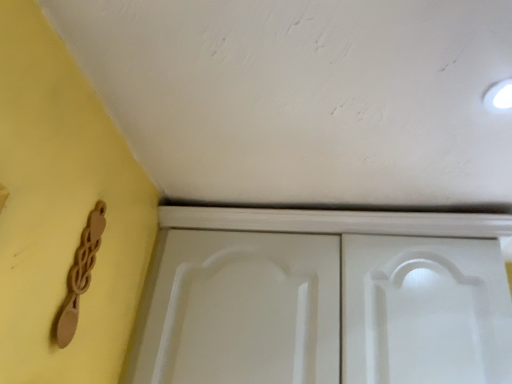
Question: Is there a large distance between wooden spoon at lower left and white matte cupboard at center?

Choices:
 (A) no
 (B) yes

Answer: (A)

Question: Does wooden spoon at lower left have a larger size compared to white matte cupboard at center?

Choices:
 (A) no
 (B) yes

Answer: (A)

Question: Does wooden spoon at lower left come in front of white matte cupboard at center?

Choices:
 (A) yes
 (B) no

Answer: (A)

Question: Is wooden spoon at lower left smaller than white matte cupboard at center?

Choices:
 (A) yes
 (B) no

Answer: (A)

Question: Does wooden spoon at lower left turn towards white matte cupboard at center?

Choices:
 (A) no
 (B) yes

Answer: (A)

Question: From the image's perspective, is wooden spoon at lower left over white matte cupboard at center?

Choices:
 (A) yes
 (B) no

Answer: (A)

Question: Is white matte cupboard at center not inside wooden spoon at lower left?

Choices:
 (A) no
 (B) yes

Answer: (B)

Question: Is white matte cupboard at center closer to camera compared to wooden spoon at lower left?

Choices:
 (A) no
 (B) yes

Answer: (A)

Question: Is the depth of white matte cupboard at center greater than that of wooden spoon at lower left?

Choices:
 (A) no
 (B) yes

Answer: (B)

Question: Can you confirm if white matte cupboard at center is shorter than wooden spoon at lower left?

Choices:
 (A) no
 (B) yes

Answer: (A)

Question: Is white matte cupboard at center at the right side of wooden spoon at lower left?

Choices:
 (A) yes
 (B) no

Answer: (A)

Question: From the image's perspective, is white matte cupboard at center beneath wooden spoon at lower left?

Choices:
 (A) no
 (B) yes

Answer: (B)

Question: Is wooden spoon at lower left spatially inside white matte cupboard at center, or outside of it?

Choices:
 (A) inside
 (B) outside

Answer: (B)